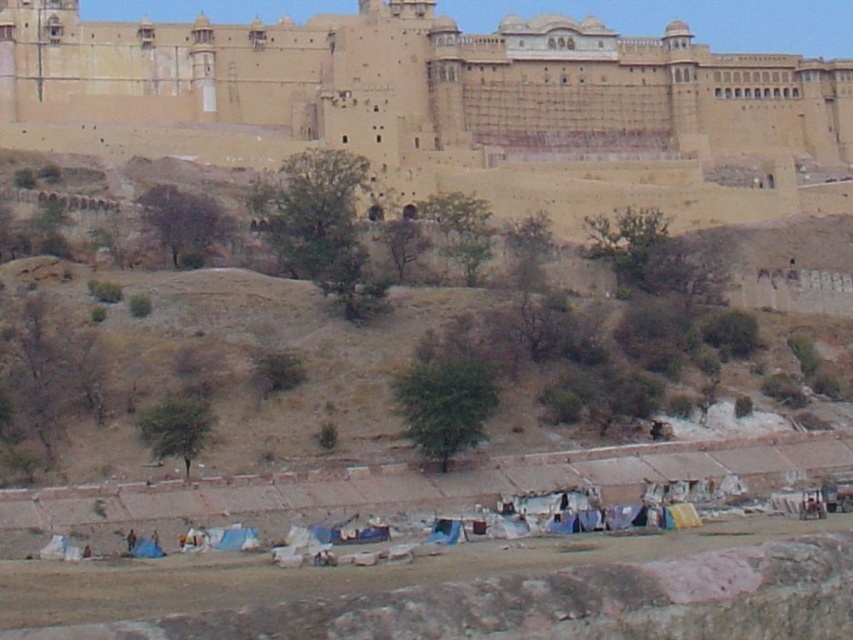
You are a photographer planning to take a landscape photo that emphasizes the contrast between the ancient fortification and the modern settlement. Given the scene described, which object should you focus on to highlight the height difference between the brown earthy hillside at center and the beige stone castle at upper center?

The brown earthy hillside at center is much taller than the beige stone castle at upper center, so focusing on the hillside would emphasize its dominance in height compared to the castle.

You are a hiker standing at the base of the hillside. You want to climb to the top of the brown earthy hillside at center. Given that your average climbing speed is 1.5 meters per minute, how long will it take you to reach the top?

The brown earthy hillside at center and viewer are 96.20 meters apart from each other. At a climbing speed of 1.5 meters per minute, it would take approximately 64.13 minutes to reach the top.

You are planning to build a small garden on the brown earthy hillside at center. Considering the beige stone castle at upper center is nearby, will the hillside provide enough space for the garden? Please explain based on their sizes.

The brown earthy hillside at center has a smaller width than the beige stone castle at upper center. Since the hillside is narrower, it might not provide sufficient space for a garden compared to the castle. However, the exact suitability depends on the garden size requirements and the hillside area available.